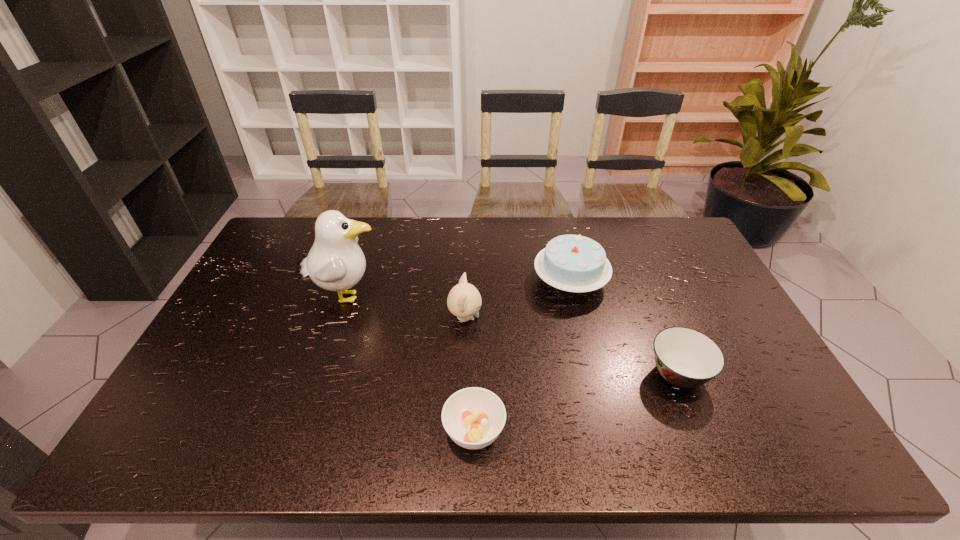
The width and height of the screenshot is (960, 540). I want to click on free spot between the shortest object and the second nearest object, so click(x=576, y=403).

Identify the location of empty space that is in between the kitten and the leftmost object. This screenshot has height=540, width=960. (405, 307).

In order to click on free space between the leftmost object and the kitten in this screenshot , I will do `click(405, 307)`.

Where is `vacant area that lies between the nearest object and the birthday cake`? The image size is (960, 540). vacant area that lies between the nearest object and the birthday cake is located at coordinates (522, 356).

You are a GUI agent. You are given a task and a screenshot of the screen. Output one action in this format:
    pyautogui.click(x=<x>, y=<y>)
    Task: Click on the free spot between the taller soup bowl and the gull
    The width and height of the screenshot is (960, 540).
    Given the screenshot: What is the action you would take?
    pyautogui.click(x=512, y=335)

Where is `vacant space that's between the farther soup bowl and the tallest object`? The width and height of the screenshot is (960, 540). vacant space that's between the farther soup bowl and the tallest object is located at coordinates (512, 335).

Locate which object ranks third in proximity to the kitten. Please provide its 2D coordinates. Your answer should be formatted as a tuple, i.e. [(x, y)], where the tuple contains the x and y coordinates of a point satisfying the conditions above.

[(473, 417)]

Identify which object is located as the nearest to the right soup bowl. Please provide its 2D coordinates. Your answer should be formatted as a tuple, i.e. [(x, y)], where the tuple contains the x and y coordinates of a point satisfying the conditions above.

[(574, 263)]

Find the location of `free space that satisfies the following two spatial constraints: 1. on the front side of the fourth object from left to right; 2. on the face of the kitten`. free space that satisfies the following two spatial constraints: 1. on the front side of the fourth object from left to right; 2. on the face of the kitten is located at coordinates (579, 318).

At what (x,y) coordinates should I click in order to perform the action: click on free location that satisfies the following two spatial constraints: 1. on the beak of the right soup bowl; 2. on the right side of the gull. Please return your answer as a coordinate pair (x, y). Looking at the image, I should click on tap(319, 374).